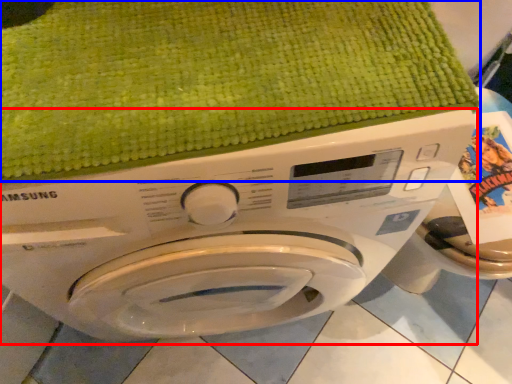
Question: Among these objects, which one is nearest to the camera, washing machine (highlighted by a red box) or bath towel (highlighted by a blue box)?

Choices:
 (A) washing machine
 (B) bath towel

Answer: (A)